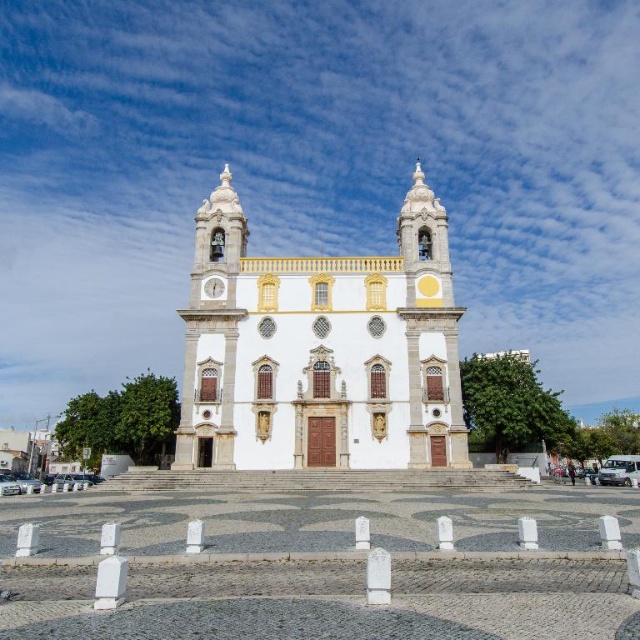
Consider the image. Between white glossy church at center and white glossy clock at center, which one appears on the right side from the viewer's perspective?

white glossy church at center is more to the right.

Is white glossy church at center smaller than white glossy clock at center?

Actually, white glossy church at center might be larger than white glossy clock at center.

Is point (417, 248) positioned after point (212, 280)?

Yes, it is.

Locate an element on the screen. This screenshot has height=640, width=640. white glossy church at center is located at coordinates (321, 349).